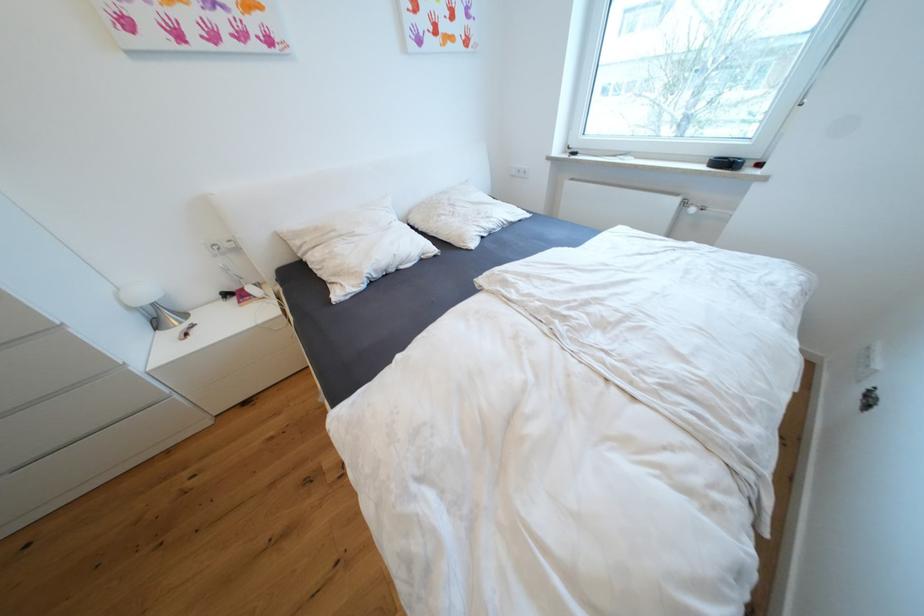
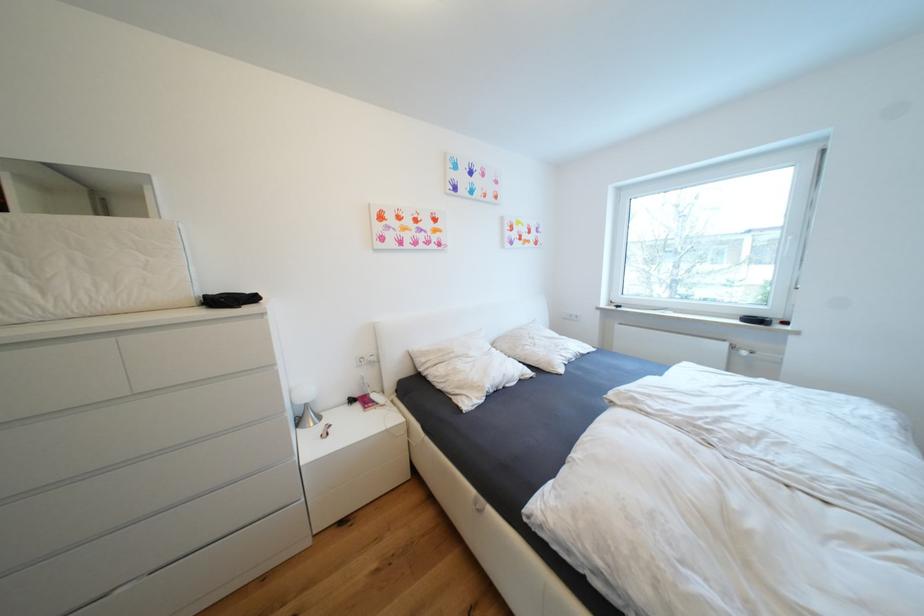
Question: The images are taken continuously from a first-person perspective. In which direction is your viewpoint rotating?

Choices:
 (A) Left
 (B) Right
 (C) Up
 (D) Down

Answer: (C)